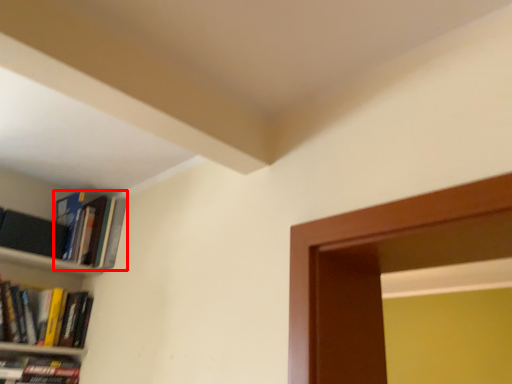
Question: In this image, where is book (annotated by the red box) located relative to book?

Choices:
 (A) left
 (B) right

Answer: (B)